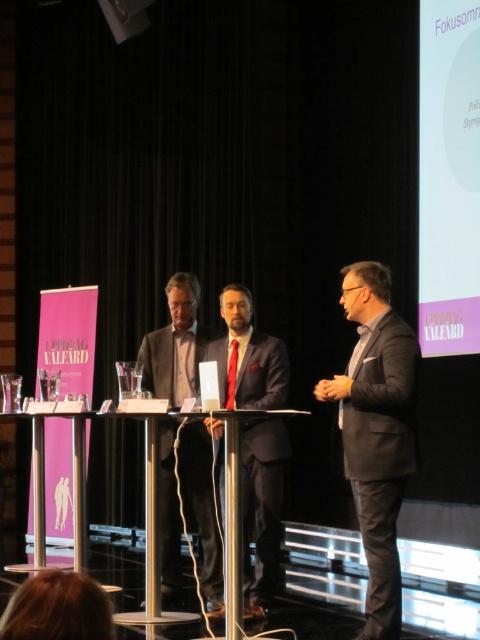
Is point (267, 344) more distant than point (156, 340)?

That is False.

Between matte black suit at center and dark gray wool suit at center, which one is positioned lower?

dark gray wool suit at center is lower down.

In order to click on matte black suit at center in this screenshot , I will do `click(263, 502)`.

Is dark gray suit at right wider than matte black suit at center?

In fact, dark gray suit at right might be narrower than matte black suit at center.

Between dark gray suit at right and matte black suit at center, which one appears on the left side from the viewer's perspective?

From the viewer's perspective, matte black suit at center appears more on the left side.

Which is in front, point (402, 451) or point (253, 476)?

Positioned in front is point (402, 451).

This screenshot has height=640, width=480. Identify the location of dark gray suit at right. (381, 458).

Between dark gray suit at right and dark gray wool suit at center, which one has more height?

dark gray wool suit at center is taller.

Which is above, dark gray suit at right or dark gray wool suit at center?

dark gray suit at right is above.

Is point (349, 426) closer to viewer compared to point (164, 461)?

Yes, it is in front of point (164, 461).

Identify the location of dark gray suit at right. This screenshot has width=480, height=640. (381, 458).